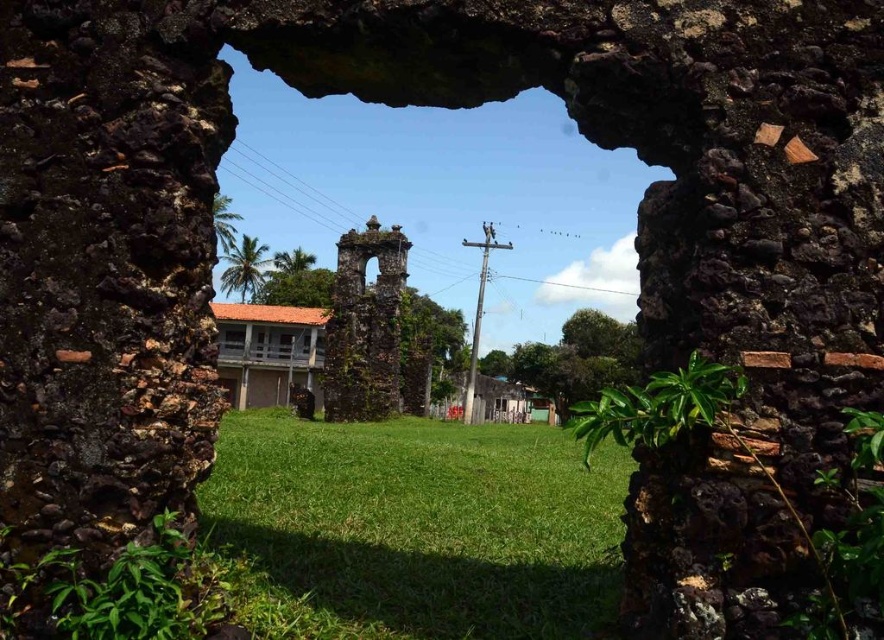
You are an architect evaluating the structural integrity of the archway and its surrounding buildings. Based on the scene, which window at the center is more likely to require reinforcement due to its height? Please refer to the clear glass window at center and transparent glass window at center in your analysis.

The clear glass window at center is much taller than the transparent glass window at center, so it is more likely to require reinforcement due to its greater height.